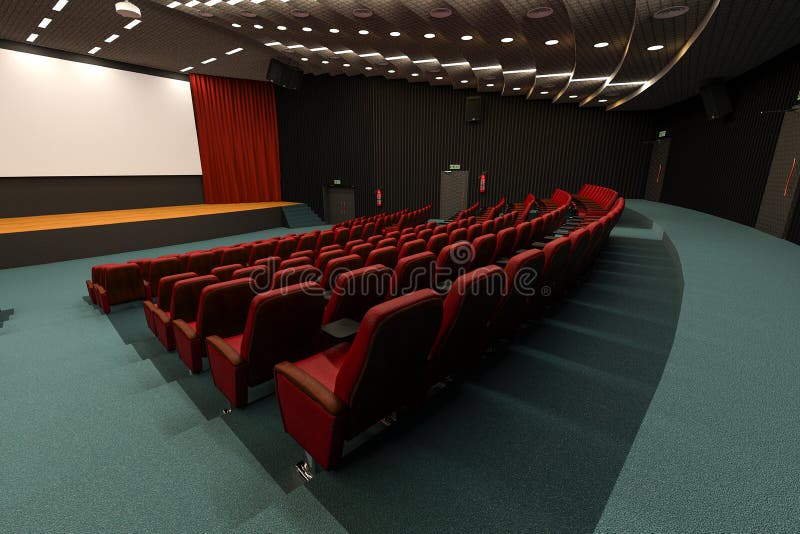
Find the location of a particular element. This screenshot has width=800, height=534. small table is located at coordinates (340, 334), (502, 262), (520, 252), (538, 245), (550, 238), (562, 234), (568, 229), (573, 226), (576, 219), (580, 218).